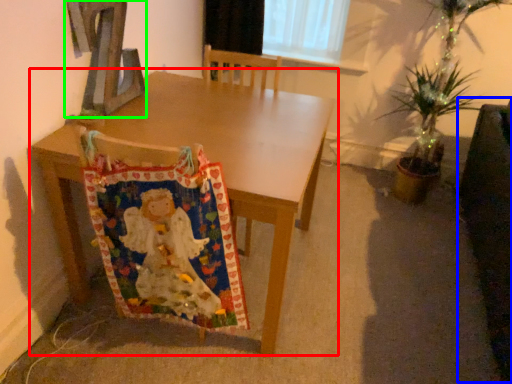
Question: Considering the real-world distances, which object is closest to table (highlighted by a red box)? swivel chair (highlighted by a blue box) or alphabet (highlighted by a green box).

Choices:
 (A) swivel chair
 (B) alphabet

Answer: (B)